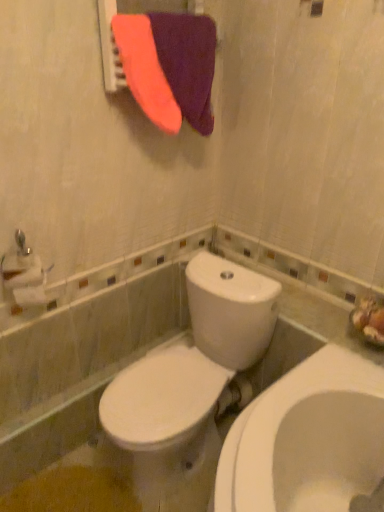
Question: From the image's perspective, is white glossy toilet at center positioned above or below purple fabric at upper center?

Choices:
 (A) above
 (B) below

Answer: (B)

Question: Do you think white glossy toilet at center is within purple fabric at upper center, or outside of it?

Choices:
 (A) outside
 (B) inside

Answer: (A)

Question: Which object is positioned closest to the white glossy toilet at center?

Choices:
 (A) purple soft towel at upper center
 (B) purple fabric at upper center
 (C) white matte toilet paper at left

Answer: (C)

Question: Considering the real-world distances, which object is closest to the white glossy toilet at center?

Choices:
 (A) white matte toilet paper at left
 (B) purple soft towel at upper center
 (C) purple fabric at upper center

Answer: (A)